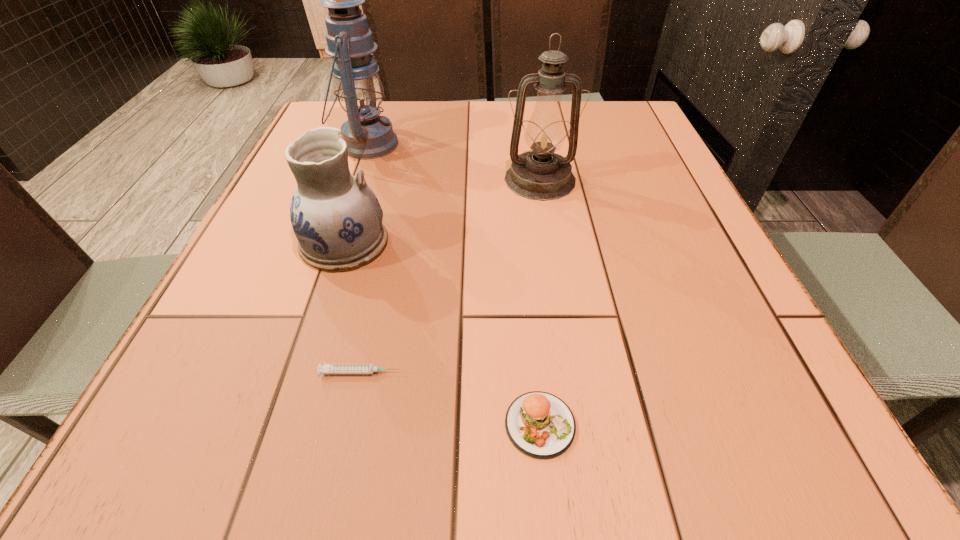
Find the location of `free space at the left edge of the desktop`. free space at the left edge of the desktop is located at coordinates (153, 413).

Where is `free space at the right edge of the desktop`? free space at the right edge of the desktop is located at coordinates (652, 252).

You are a GUI agent. You are given a task and a screenshot of the screen. Output one action in this format:
    pyautogui.click(x=<x>, y=<y>)
    Task: Click on the vacant space at the far left corner
    This screenshot has height=540, width=960.
    Given the screenshot: What is the action you would take?
    pyautogui.click(x=344, y=117)

Identify the location of vacant space at the far right corner. This screenshot has width=960, height=540. (620, 128).

At what (x,y) coordinates should I click in order to perform the action: click on vacant area that lies between the oil lamp and the fourth tallest object. Please return your answer as a coordinate pair (x, y). The image size is (960, 540). Looking at the image, I should click on (540, 302).

Where is `vacant space that is in between the oil lamp and the pottery`? The width and height of the screenshot is (960, 540). vacant space that is in between the oil lamp and the pottery is located at coordinates (442, 211).

At what (x,y) coordinates should I click in order to perform the action: click on free spot between the syringe and the third farthest object. Please return your answer as a coordinate pair (x, y). Looking at the image, I should click on (352, 308).

At what (x,y) coordinates should I click in order to perform the action: click on blank region between the oil lamp and the nearest object. Please return your answer as a coordinate pair (x, y). The width and height of the screenshot is (960, 540). Looking at the image, I should click on (540, 302).

Find the location of a particular element. Image resolution: width=960 pixels, height=540 pixels. vacant space that is in between the oil lamp and the pottery is located at coordinates (442, 211).

Image resolution: width=960 pixels, height=540 pixels. I want to click on empty space that is in between the fourth farthest object and the nearest object, so click(x=450, y=399).